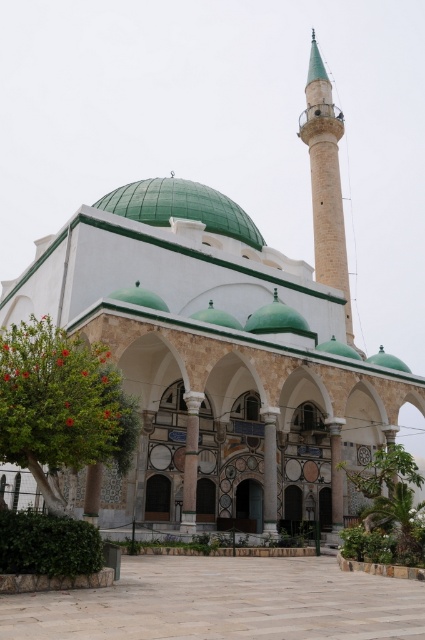
Question: Can you confirm if light beige stone minaret at upper center is smaller than polished stone arch at center?

Choices:
 (A) no
 (B) yes

Answer: (A)

Question: Considering the relative positions of white marble column at center and polished stone arch at center in the image provided, where is white marble column at center located with respect to polished stone arch at center?

Choices:
 (A) right
 (B) left

Answer: (B)

Question: Does white marble column at center have a smaller size compared to polished stone arch at center?

Choices:
 (A) yes
 (B) no

Answer: (B)

Question: Which point is farther to the camera?

Choices:
 (A) white marble column at center
 (B) polished stone arch at center

Answer: (B)

Question: Estimate the real-world distances between objects in this image. Which object is farther from the white marble column at center?

Choices:
 (A) white marble pillar at center
 (B) light beige stone minaret at upper center
 (C) green tile dome at center
 (D) polished stone arch at center

Answer: (B)

Question: Which object is closer to the camera taking this photo?

Choices:
 (A) light beige stone minaret at upper center
 (B) green tile dome at center
 (C) polished stone arch at center

Answer: (C)